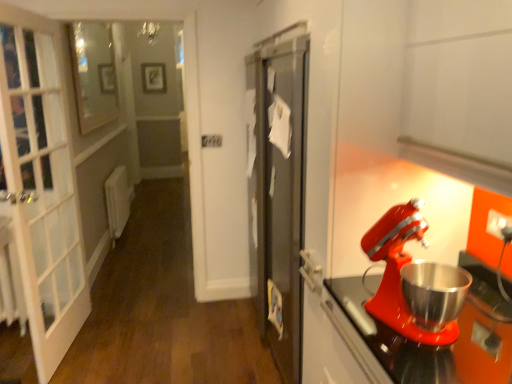
Question: Are matte red mixer at right and matte black picture frame at upper center located far from each other?

Choices:
 (A) yes
 (B) no

Answer: (A)

Question: From the image's perspective, would you say matte red mixer at right is shown under matte black picture frame at upper center?

Choices:
 (A) yes
 (B) no

Answer: (A)

Question: Can you confirm if matte red mixer at right is shorter than matte black picture frame at upper center?

Choices:
 (A) no
 (B) yes

Answer: (B)

Question: Does matte red mixer at right have a smaller size compared to matte black picture frame at upper center?

Choices:
 (A) no
 (B) yes

Answer: (A)

Question: Can you confirm if matte red mixer at right is positioned to the right of matte black picture frame at upper center?

Choices:
 (A) yes
 (B) no

Answer: (A)

Question: Is matte red mixer at right facing away from matte black picture frame at upper center?

Choices:
 (A) yes
 (B) no

Answer: (B)

Question: Is clear glass window at upper left not inside matte red mixer at right?

Choices:
 (A) yes
 (B) no

Answer: (A)

Question: From a real-world perspective, is clear glass window at upper left beneath matte red mixer at right?

Choices:
 (A) no
 (B) yes

Answer: (A)

Question: Does clear glass window at upper left have a greater width compared to matte red mixer at right?

Choices:
 (A) no
 (B) yes

Answer: (A)

Question: Does clear glass window at upper left come in front of matte red mixer at right?

Choices:
 (A) yes
 (B) no

Answer: (B)

Question: Is clear glass window at upper left taller than matte red mixer at right?

Choices:
 (A) no
 (B) yes

Answer: (B)

Question: Is clear glass window at upper left turned away from matte red mixer at right?

Choices:
 (A) yes
 (B) no

Answer: (B)

Question: Is matte black picture frame at upper center looking in the opposite direction of matte red mixer at right?

Choices:
 (A) yes
 (B) no

Answer: (B)